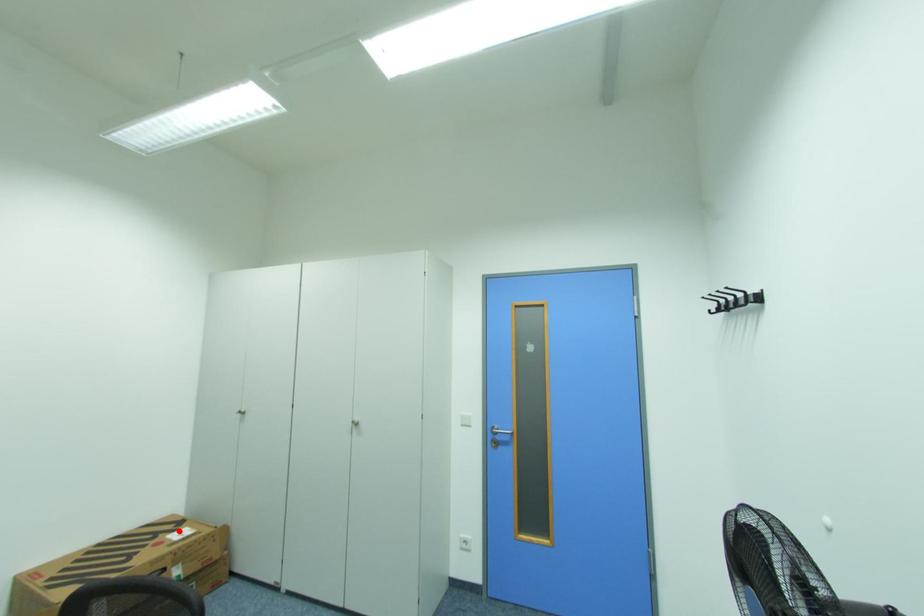
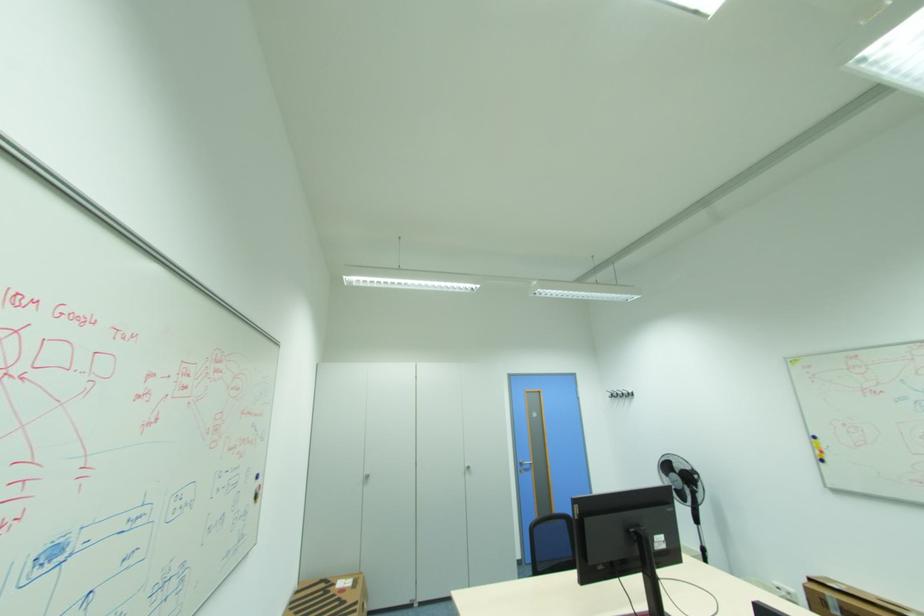
The point at the highlighted location is marked in the first image. Where is the corresponding point in the second image?

(338, 585)